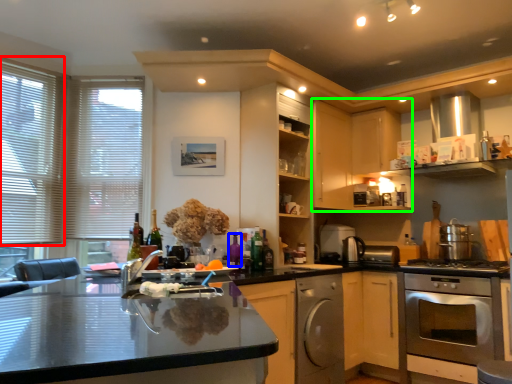
Question: Based on their relative distances, which object is farther from window (highlighted by a red box)? Choose from bottle (highlighted by a blue box) and cabinetry (highlighted by a green box).

Choices:
 (A) bottle
 (B) cabinetry

Answer: (B)